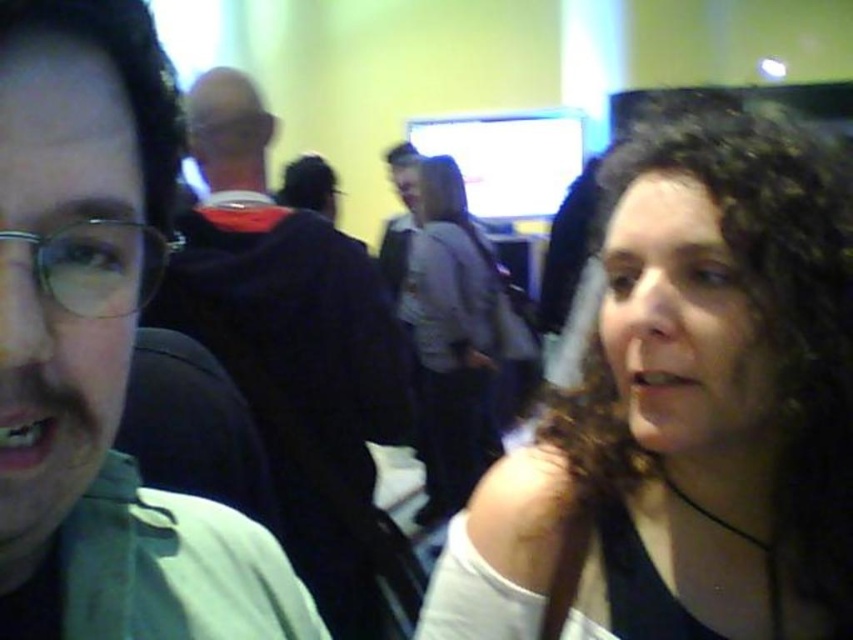
Question: Which is farther from the green matte shirt at left?

Choices:
 (A) metallic frame glasses at left
 (B) gray fabric shirt at center

Answer: (B)

Question: Which point is farther from the camera taking this photo?

Choices:
 (A) (36, 284)
 (B) (236, 134)
 (C) (258, 284)
 (D) (450, 333)

Answer: (D)

Question: Can you confirm if dark blue jacket at center is wider than metallic frame glasses at left?

Choices:
 (A) yes
 (B) no

Answer: (A)

Question: Is metallic frame glasses at left below matte black glasses at center?

Choices:
 (A) yes
 (B) no

Answer: (A)

Question: Among these points, which one is farthest from the camera?

Choices:
 (A) (160, 250)
 (B) (445, 460)
 (C) (238, 136)
 (D) (357, 460)

Answer: (B)

Question: Does green matte shirt at left come in front of gray fabric shirt at center?

Choices:
 (A) no
 (B) yes

Answer: (B)